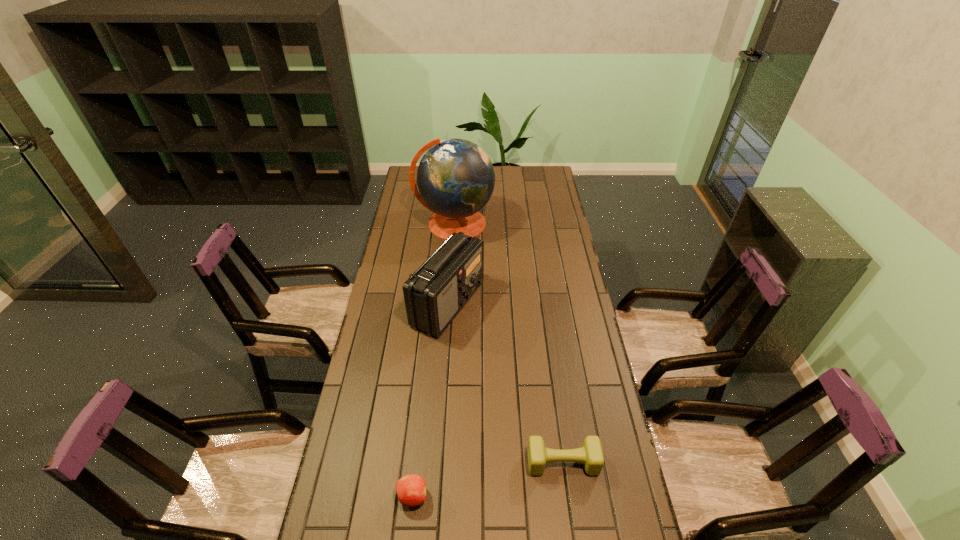
The height and width of the screenshot is (540, 960). What are the coordinates of `empty space between the nearest object and the dumbbell` in the screenshot? It's located at (488, 480).

What are the coordinates of `free spot between the dumbbell and the radio receiver` in the screenshot? It's located at (505, 383).

The image size is (960, 540). I want to click on empty space that is in between the nearest object and the dumbbell, so click(x=488, y=480).

I want to click on blank region between the apple and the third shortest object, so click(430, 400).

Identify which object is the third closest to the farthest object. Please provide its 2D coordinates. Your answer should be formatted as a tuple, i.e. [(x, y)], where the tuple contains the x and y coordinates of a point satisfying the conditions above.

[(411, 489)]

Where is `the closest object to the tallest object`? The image size is (960, 540). the closest object to the tallest object is located at coordinates (434, 294).

Locate an element on the screen. free space in the image that satisfies the following two spatial constraints: 1. with the Americas facing the viewer on the tallest object; 2. on the front panel of the second farthest object is located at coordinates (448, 303).

At what (x,y) coordinates should I click in order to perform the action: click on vacant region that satisfies the following two spatial constraints: 1. on the front panel of the third nearest object; 2. on the left side of the third farthest object. Please return your answer as a coordinate pair (x, y). This screenshot has height=540, width=960. Looking at the image, I should click on (437, 462).

Image resolution: width=960 pixels, height=540 pixels. What are the coordinates of `free space that satisfies the following two spatial constraints: 1. with the Americas facing the viewer on the globe; 2. on the front panel of the third nearest object` in the screenshot? It's located at (448, 303).

This screenshot has width=960, height=540. In order to click on free location that satisfies the following two spatial constraints: 1. with the Americas facing the viewer on the third farthest object; 2. on the left side of the globe in this screenshot , I will do `click(437, 462)`.